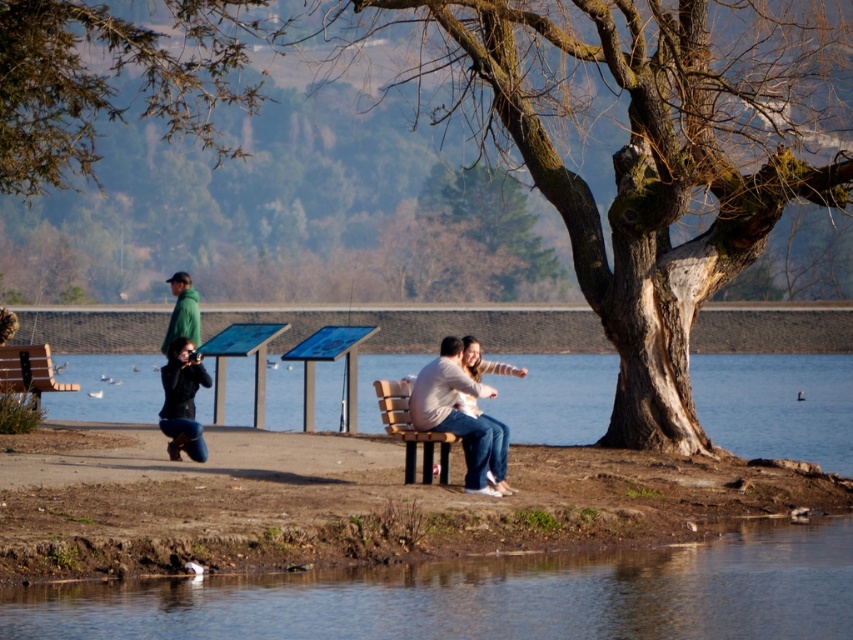
Does wooden bench at left appear on the left side of green fleece jacket at left?

Correct, you'll find wooden bench at left to the left of green fleece jacket at left.

Is point (1, 371) positioned behind point (173, 292)?

No, (1, 371) is in front of (173, 292).

At what (x,y) coordinates should I click in order to perform the action: click on wooden bench at left. Please return your answer as a coordinate pair (x, y). Looking at the image, I should click on (28, 371).

Does smooth bark tree at center have a lesser width compared to clear blue water at bench right?

Yes.

Is smooth bark tree at center positioned behind clear blue water at bench right?

Yes, smooth bark tree at center is behind clear blue water at bench right.

This screenshot has width=853, height=640. I want to click on smooth bark tree at center, so click(x=642, y=147).

Is wooden bench at center below green fleece jacket at left?

Correct, wooden bench at center is located below green fleece jacket at left.

Who is lower down, wooden bench at center or green fleece jacket at left?

Positioned lower is wooden bench at center.

At what (x,y) coordinates should I click in order to perform the action: click on wooden bench at center. Please return your answer as a coordinate pair (x, y). Looking at the image, I should click on (410, 429).